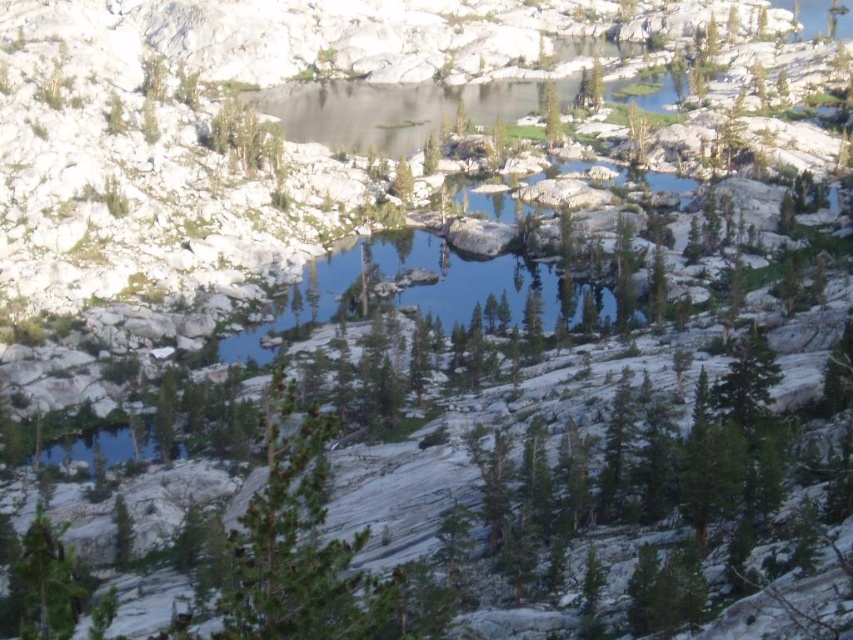
Question: Is green textured pine tree at center wider than green matte tree at lower left?

Choices:
 (A) no
 (B) yes

Answer: (A)

Question: Which point appears farthest from the camera in this image?

Choices:
 (A) (49, 596)
 (B) (350, 541)

Answer: (B)

Question: Can you confirm if green textured pine tree at center is positioned to the left of green matte tree at lower left?

Choices:
 (A) yes
 (B) no

Answer: (B)

Question: Among these points, which one is nearest to the camera?

Choices:
 (A) (271, 396)
 (B) (53, 576)

Answer: (B)

Question: Is green textured pine tree at center wider than green matte tree at lower left?

Choices:
 (A) yes
 (B) no

Answer: (B)